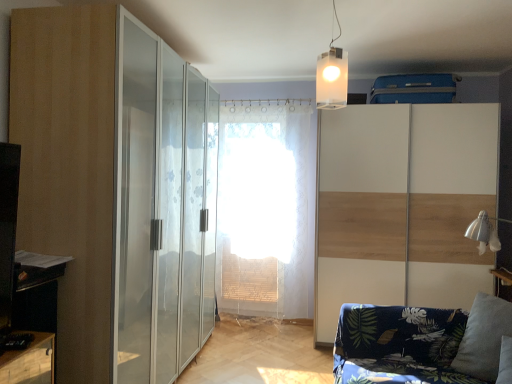
Question: Is white wood screen door at right, the 1th screen door when ordered from right to left, completely or partially outside of translucent plastic cube at upper center?

Choices:
 (A) no
 (B) yes

Answer: (B)

Question: Does white wood screen door at right, acting as the second screen door starting from the left, come in front of translucent plastic cube at upper center?

Choices:
 (A) no
 (B) yes

Answer: (A)

Question: Considering the relative positions of white wood screen door at right, acting as the second screen door starting from the left, and translucent plastic cube at upper center in the image provided, is white wood screen door at right, acting as the second screen door starting from the left, behind translucent plastic cube at upper center?

Choices:
 (A) no
 (B) yes

Answer: (B)

Question: Can you confirm if white wood screen door at right, acting as the second screen door starting from the left, is smaller than translucent plastic cube at upper center?

Choices:
 (A) yes
 (B) no

Answer: (B)

Question: Is translucent plastic cube at upper center located within white wood screen door at right, the 1th screen door when ordered from right to left?

Choices:
 (A) yes
 (B) no

Answer: (B)

Question: From the image's perspective, is white wood screen door at right, acting as the second screen door starting from the left, located beneath translucent plastic cube at upper center?

Choices:
 (A) no
 (B) yes

Answer: (B)

Question: Is matte glass door at left outside of gray fabric pillow at lower right?

Choices:
 (A) no
 (B) yes

Answer: (B)

Question: Can you confirm if matte glass door at left is smaller than gray fabric pillow at lower right?

Choices:
 (A) yes
 (B) no

Answer: (B)

Question: From a real-world perspective, is matte glass door at left below gray fabric pillow at lower right?

Choices:
 (A) yes
 (B) no

Answer: (B)

Question: Does matte glass door at left appear on the right side of gray fabric pillow at lower right?

Choices:
 (A) yes
 (B) no

Answer: (B)

Question: Is matte glass door at left placed right next to gray fabric pillow at lower right?

Choices:
 (A) yes
 (B) no

Answer: (B)

Question: Can you confirm if matte glass door at left is positioned to the left of gray fabric pillow at lower right?

Choices:
 (A) no
 (B) yes

Answer: (B)

Question: Is white sheer curtain at center positioned behind transparent glass wardrobe at center, the 2th screen door viewed from the right?

Choices:
 (A) no
 (B) yes

Answer: (B)